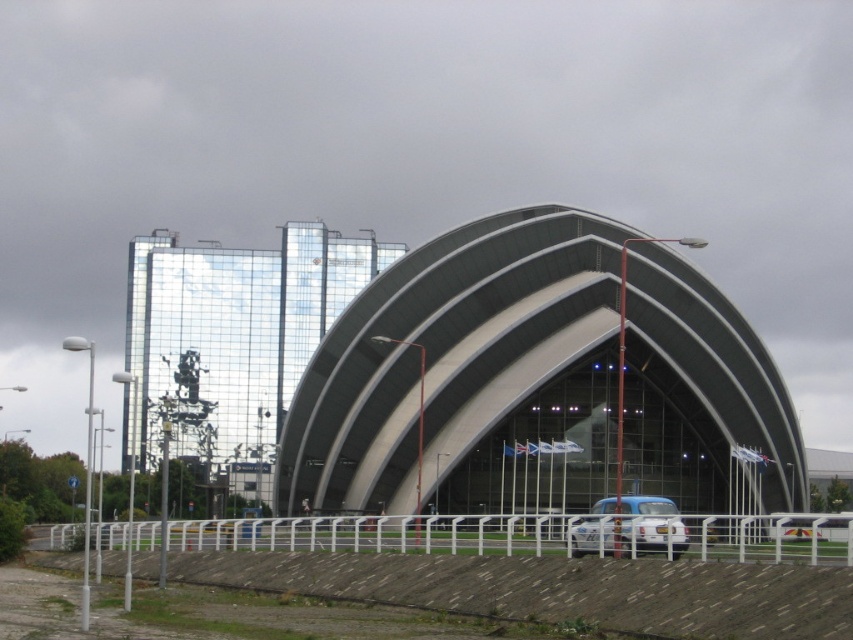
Question: Based on their relative distances, which object is farther from the smooth glass dome at center?

Choices:
 (A) reflective glass building at center
 (B) blue matte car at center

Answer: (A)

Question: In this image, where is smooth glass dome at center located relative to reflective glass building at center?

Choices:
 (A) left
 (B) right

Answer: (B)

Question: Does reflective glass building at center appear on the right side of blue matte car at center?

Choices:
 (A) no
 (B) yes

Answer: (A)

Question: Can you confirm if smooth glass dome at center is wider than reflective glass building at center?

Choices:
 (A) yes
 (B) no

Answer: (B)

Question: Which object is closer to the camera taking this photo?

Choices:
 (A) reflective glass building at center
 (B) smooth glass dome at center
 (C) blue matte car at center

Answer: (C)

Question: Which point appears farthest from the camera in this image?

Choices:
 (A) (503, 324)
 (B) (595, 540)

Answer: (A)